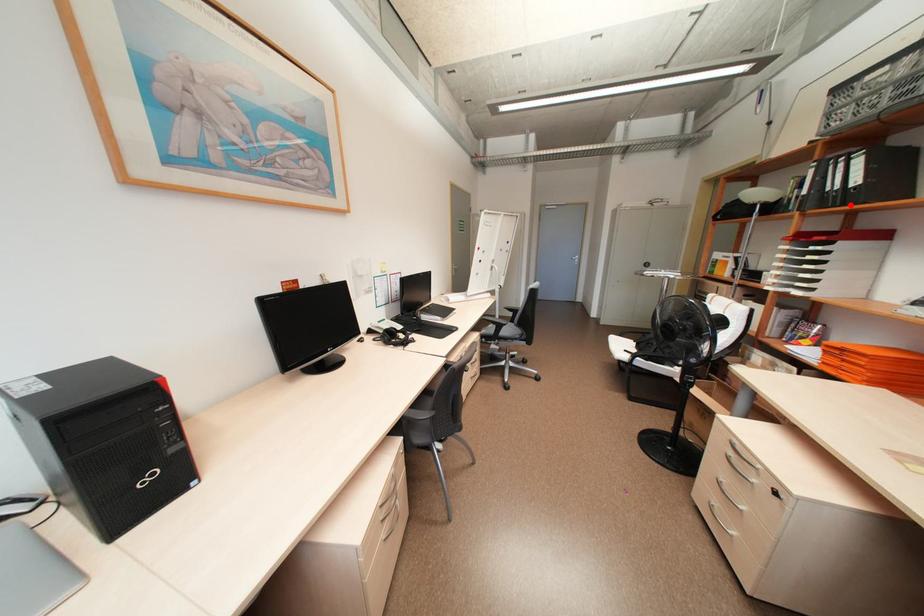
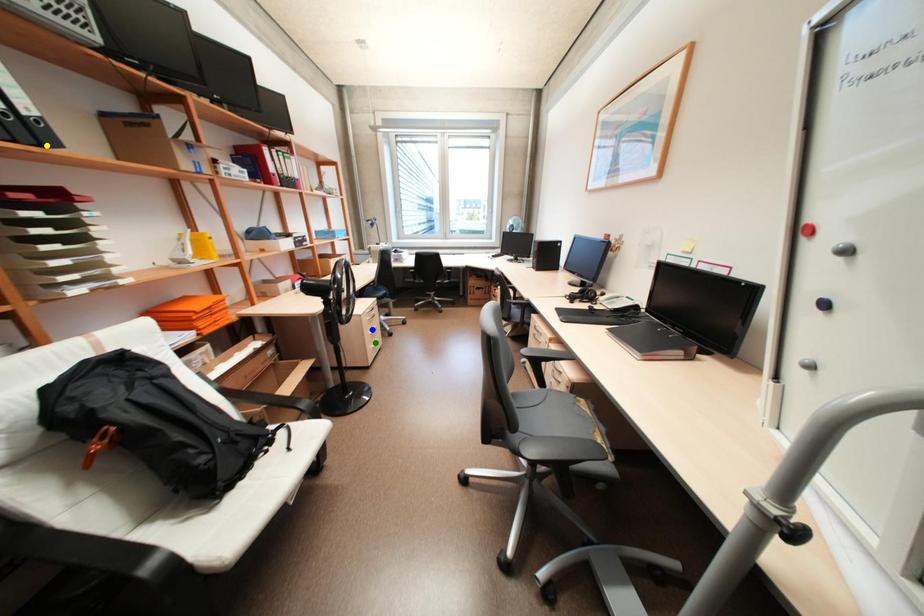
Question: I am providing you with two images of the same scene from different viewpoints. A red point is marked on the first image. You are given multiple points on the second image. Which mark in image 2 goes with the point in image 1?

Choices:
 (A) green point
 (B) yellow point
 (C) blue point

Answer: (B)